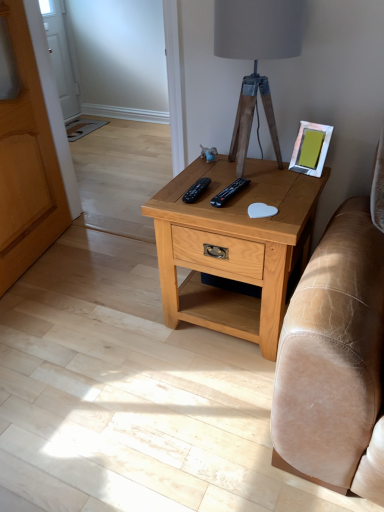
Question: Does wooden armoire at left have a greater width compared to wooden tripod lamp at center?

Choices:
 (A) no
 (B) yes

Answer: (A)

Question: Is wooden armoire at left facing towards wooden tripod lamp at center?

Choices:
 (A) no
 (B) yes

Answer: (B)

Question: Does wooden armoire at left have a larger size compared to wooden tripod lamp at center?

Choices:
 (A) no
 (B) yes

Answer: (B)

Question: Are wooden armoire at left and wooden tripod lamp at center beside each other?

Choices:
 (A) no
 (B) yes

Answer: (A)

Question: Would you say wooden armoire at left contains wooden tripod lamp at center?

Choices:
 (A) no
 (B) yes

Answer: (A)

Question: Considering the relative sizes of wooden armoire at left and wooden tripod lamp at center in the image provided, is wooden armoire at left taller than wooden tripod lamp at center?

Choices:
 (A) yes
 (B) no

Answer: (A)

Question: From the image's perspective, is metallic silver picture frame at upper right beneath black plastic remote at center, placed as the first remote when sorted from left to right?

Choices:
 (A) no
 (B) yes

Answer: (A)

Question: Is black plastic remote at center, placed as the first remote when sorted from left to right, a part of metallic silver picture frame at upper right?

Choices:
 (A) no
 (B) yes

Answer: (A)

Question: Is metallic silver picture frame at upper right facing towards black plastic remote at center, placed as the first remote when sorted from left to right?

Choices:
 (A) yes
 (B) no

Answer: (B)

Question: Is metallic silver picture frame at upper right directly adjacent to black plastic remote at center, placed as the first remote when sorted from left to right?

Choices:
 (A) yes
 (B) no

Answer: (B)

Question: From a real-world perspective, is metallic silver picture frame at upper right below black plastic remote at center, placed as the first remote when sorted from left to right?

Choices:
 (A) no
 (B) yes

Answer: (A)

Question: Does metallic silver picture frame at upper right appear on the left side of black plastic remote at center, placed as the first remote when sorted from left to right?

Choices:
 (A) yes
 (B) no

Answer: (B)

Question: Is black plastic remote at center, which is the second remote in left-to-right order, further to camera compared to light brown wood nightstand at center?

Choices:
 (A) yes
 (B) no

Answer: (A)